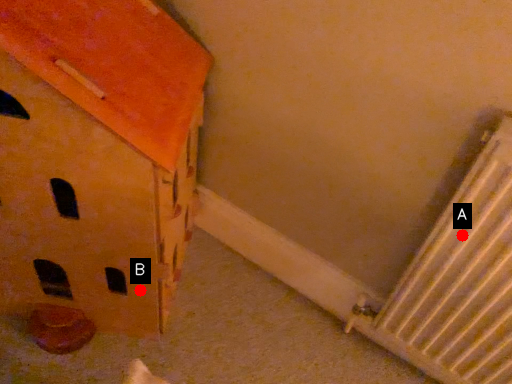
Question: Two points are circled on the image, labeled by A and B beside each circle. Which of the following is the closest to the observer?

Choices:
 (A) A is closer
 (B) B is closer

Answer: (A)